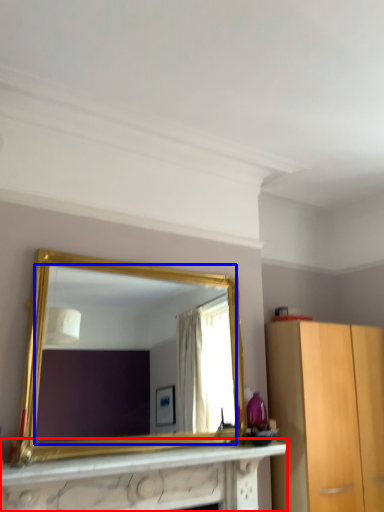
Question: Which object appears closest to the camera in this image, vanity (highlighted by a red box) or mirror (highlighted by a blue box)?

Choices:
 (A) vanity
 (B) mirror

Answer: (A)